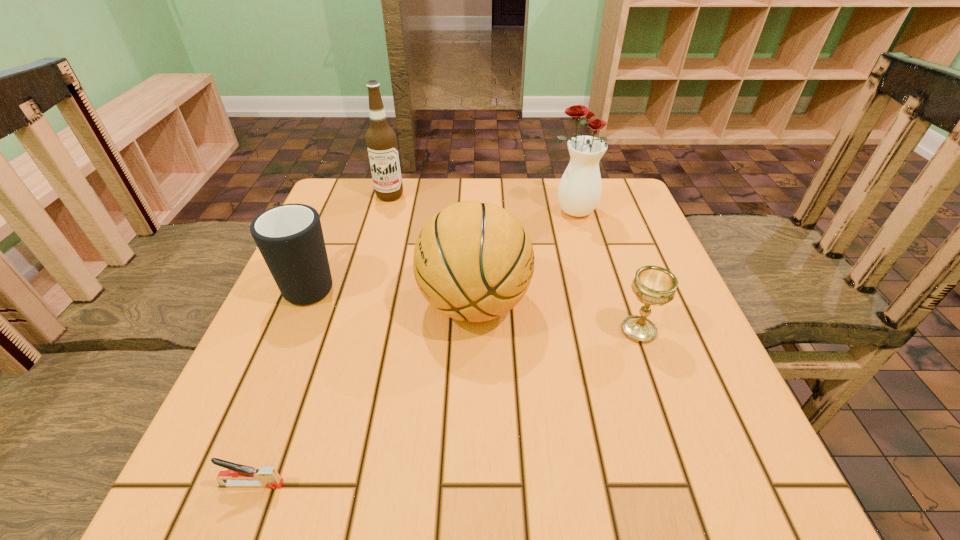
The image size is (960, 540). Find the location of `mug that is at the left edge`. mug that is at the left edge is located at coordinates (289, 237).

The width and height of the screenshot is (960, 540). Find the location of `stapler that is at the left edge`. stapler that is at the left edge is located at coordinates (238, 475).

Find the location of a particular element. vase at the right edge is located at coordinates (579, 192).

This screenshot has width=960, height=540. Find the location of `chalice that is positioned at the right edge`. chalice that is positioned at the right edge is located at coordinates (653, 285).

The image size is (960, 540). Identify the location of object located at the far left corner. (381, 140).

The height and width of the screenshot is (540, 960). Find the location of `object that is at the near left corner`. object that is at the near left corner is located at coordinates (238, 475).

This screenshot has width=960, height=540. Find the location of `object positioned at the far right corner`. object positioned at the far right corner is located at coordinates (579, 192).

The width and height of the screenshot is (960, 540). What are the coordinates of `blank space at the far edge of the desktop` in the screenshot? It's located at (438, 184).

Where is `vacant space at the near edge of the desktop`? vacant space at the near edge of the desktop is located at coordinates (328, 505).

Locate an element on the screen. free location at the right edge is located at coordinates [x=644, y=350].